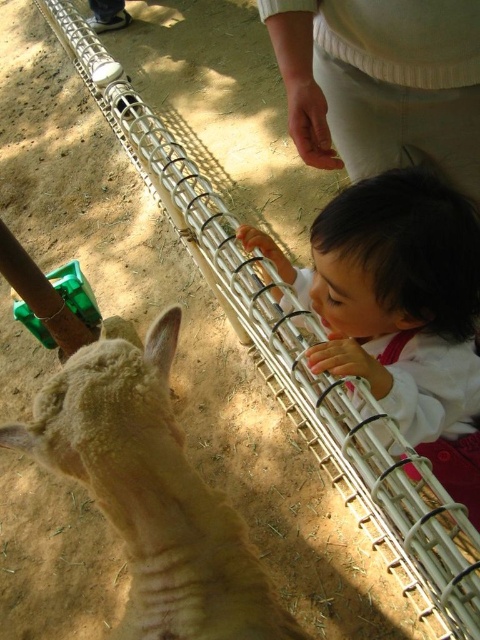
You are a parent watching your child at the petting zoo. Your child is wearing a smooth white shirt at center and interacting with a fuzzy woolen sheep at center. From your perspective, which object is lower in position?

The fuzzy woolen sheep at center is below smooth white shirt at center, so the fuzzy woolen sheep at center is lower in position.

You are a parent at the petting zoo and want to ensure your child can comfortably reach the fuzzy woolen sheep at center while wearing the smooth white shirt at center. Based on their heights, is the sheep within the child reach?

The fuzzy woolen sheep at center is not as tall as the smooth white shirt at center, which means the sheep is shorter than the shirt. Since the shirt is part of the child, the sheep is likely within the child reach.

From the picture: You are a parent at the petting zoo and notice your child wearing the smooth white shirt at center near the fuzzy woolen sheep at center. Considering their sizes, which clothing item is more likely to get dirty from the sheep?

The fuzzy woolen sheep at center is smaller than the smooth white shirt at center. However, since the sheep is the animal, its wool could shed or have dirt that might transfer to the shirt. Therefore, the smooth white shirt at center is more likely to get dirty from the sheep.